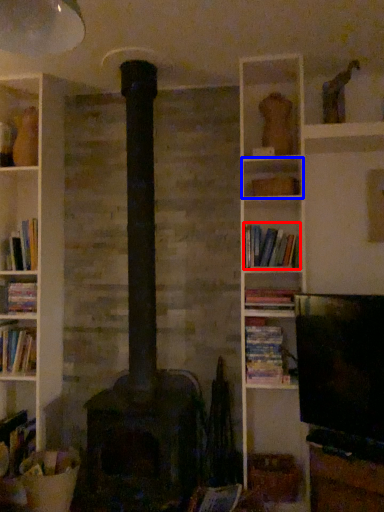
Question: Which of the following is the farthest to the observer, book (highlighted by a red box) or shelf (highlighted by a blue box)?

Choices:
 (A) book
 (B) shelf

Answer: (B)